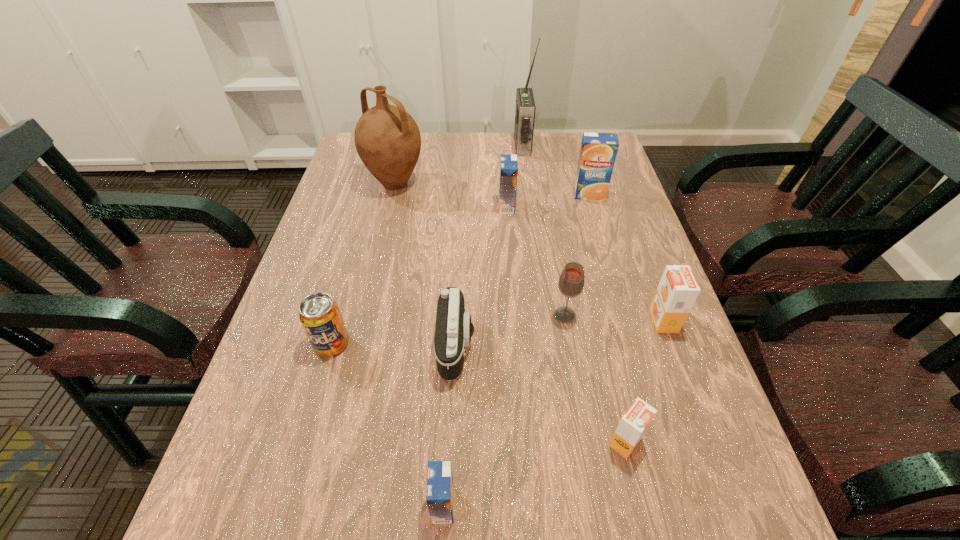
At what (x,y) coordinates should I click in order to perform the action: click on object located in the near edge section of the desktop. Please return your answer as a coordinate pair (x, y). The width and height of the screenshot is (960, 540). Looking at the image, I should click on coord(440,489).

I want to click on pitcher positioned at the left edge, so click(x=387, y=139).

This screenshot has width=960, height=540. In order to click on soda can present at the left edge in this screenshot , I will do `click(319, 314)`.

The width and height of the screenshot is (960, 540). Identify the location of object present at the far left corner. (387, 139).

At what (x,y) coordinates should I click in order to perform the action: click on free spot at the far edge of the desktop. Please return your answer as a coordinate pair (x, y). Looking at the image, I should click on (464, 145).

This screenshot has height=540, width=960. I want to click on vacant space at the near edge of the desktop, so click(x=491, y=526).

You are a GUI agent. You are given a task and a screenshot of the screen. Output one action in this format:
    pyautogui.click(x=<x>, y=<y>)
    Task: Click on the vacant region at the left edge of the desktop
    
    Given the screenshot: What is the action you would take?
    pyautogui.click(x=324, y=228)

The height and width of the screenshot is (540, 960). I want to click on free spot at the right edge of the desktop, so click(x=666, y=488).

What are the coordinates of `free space between the second tallest object and the soda can` in the screenshot? It's located at (363, 264).

This screenshot has width=960, height=540. I want to click on vacant area between the farther orange orange juice and the second tallest object, so click(529, 252).